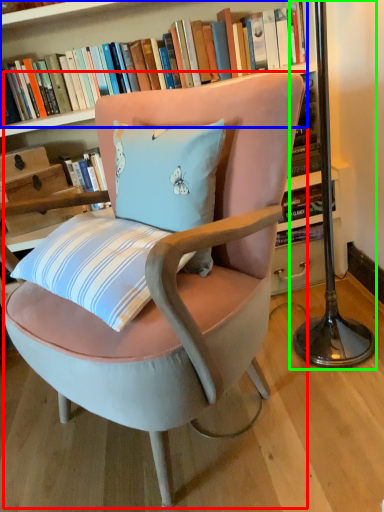
Question: Based on their relative distances, which object is nearer to chair (highlighted by a red box)? Choose from book (highlighted by a blue box) and table lamp (highlighted by a green box).

Choices:
 (A) book
 (B) table lamp

Answer: (B)